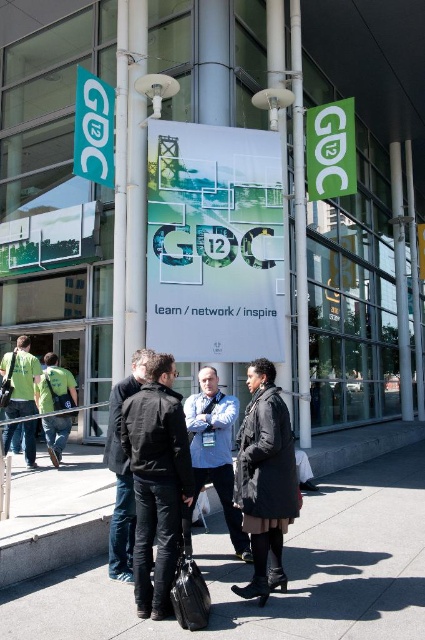
Looking at this image, you are standing at the entrance of the GDC 2012 venue and want to walk to the registration desk located at the center of the gray concrete pavement at center. What is the 2D coordinate of your destination?

The 2D coordinate of the gray concrete pavement at center is at point (285, 566).

In the scene shown: You are standing at the Game Developers Conference 2012 venue and notice two points marked in the scene. Which point, point (34, 608) or point (198, 472), is closer to you?

Point (34, 608) is closer to the viewer than point (198, 472).

You are standing at the point marked as point (14,636). You want to throw a ball to a friend who is standing 4 meters away from you. Will you be able to reach them?

The distance between you and your friend is 4 meters, but the point (14,636) is only 3.52 meters away from the viewer. Therefore, you cannot reach them as the distance is shorter than required.